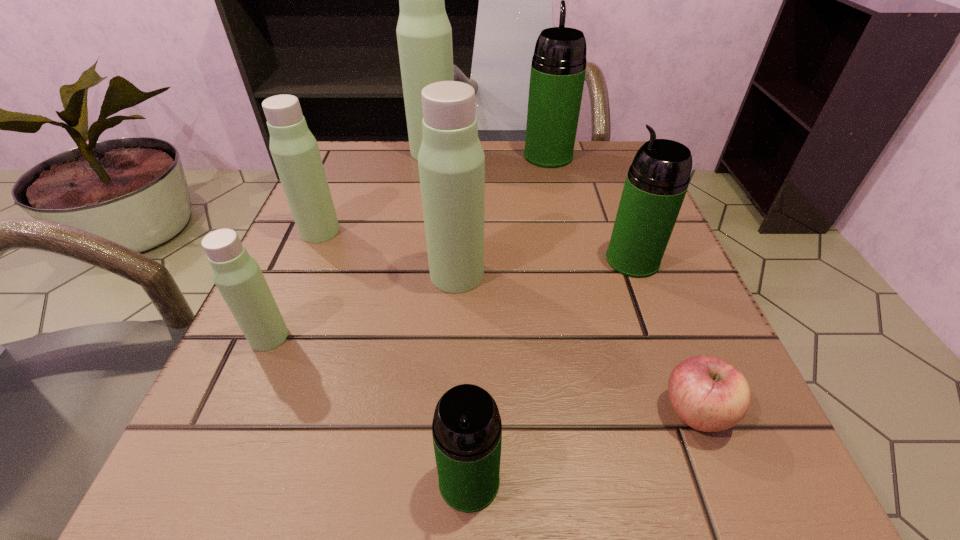
Image resolution: width=960 pixels, height=540 pixels. In order to click on the nearest green thermos bottle in this screenshot , I will do `click(467, 430)`.

Find the location of a particular element. This screenshot has width=960, height=540. the leftmost green thermos bottle is located at coordinates (467, 430).

At what (x,y) coordinates should I click in order to perform the action: click on the shortest object. Please return your answer as a coordinate pair (x, y). The height and width of the screenshot is (540, 960). Looking at the image, I should click on (708, 394).

What are the coordinates of `apple` in the screenshot? It's located at (708, 394).

You are a GUI agent. You are given a task and a screenshot of the screen. Output one action in this format:
    pyautogui.click(x=<x>, y=<y>)
    Task: Click on the vacant area situated on the right of the tallest thermos bottle
    
    Given the screenshot: What is the action you would take?
    pyautogui.click(x=500, y=152)

At what (x,y) coordinates should I click in order to perform the action: click on free region located 0.150m on the front of the second biggest light thermos bottle. Please return your answer as a coordinate pair (x, y). Looking at the image, I should click on (451, 376).

Find the location of a particular element. This screenshot has height=540, width=960. free space located 0.130m on the back of the second smallest light thermos bottle is located at coordinates (341, 182).

This screenshot has height=540, width=960. I want to click on free space located from the spout of the second smallest green thermos bottle, so click(482, 260).

Where is `blank space located from the spout of the second smallest green thermos bottle`? blank space located from the spout of the second smallest green thermos bottle is located at coordinates (441, 260).

The width and height of the screenshot is (960, 540). What are the coordinates of `free space located from the spout of the second smallest green thermos bottle` in the screenshot? It's located at (422, 260).